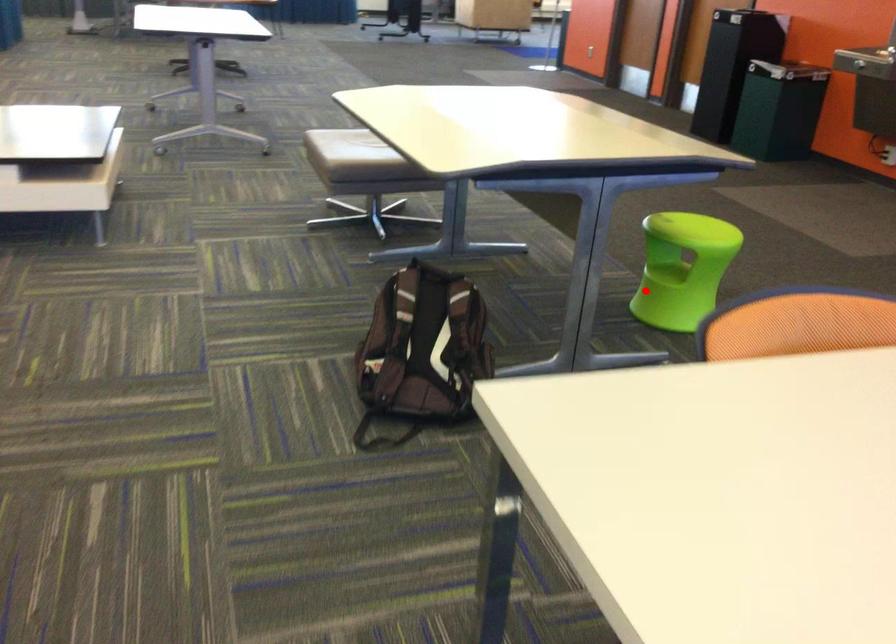
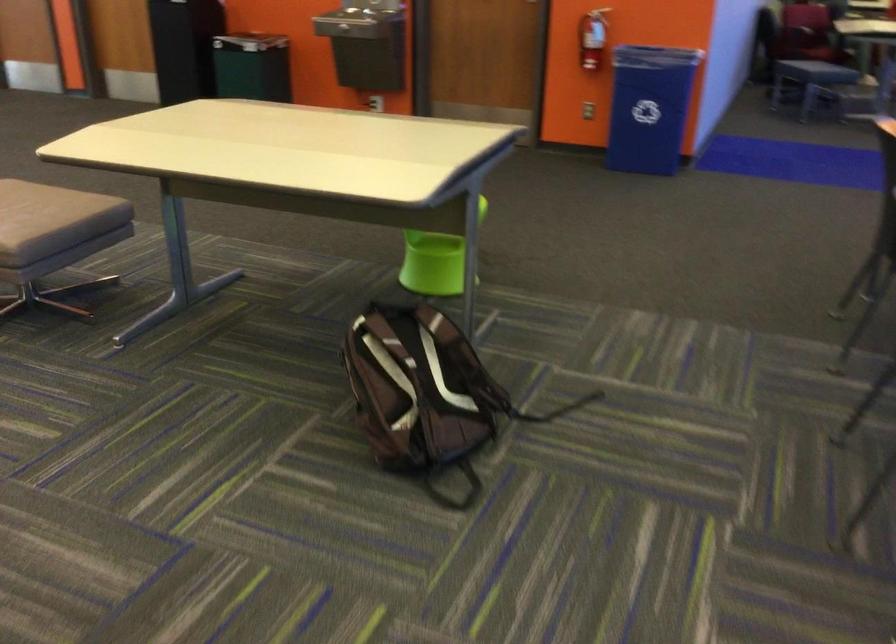
Where in the second image is the point corresponding to the highlighted location from the first image?

(435, 261)